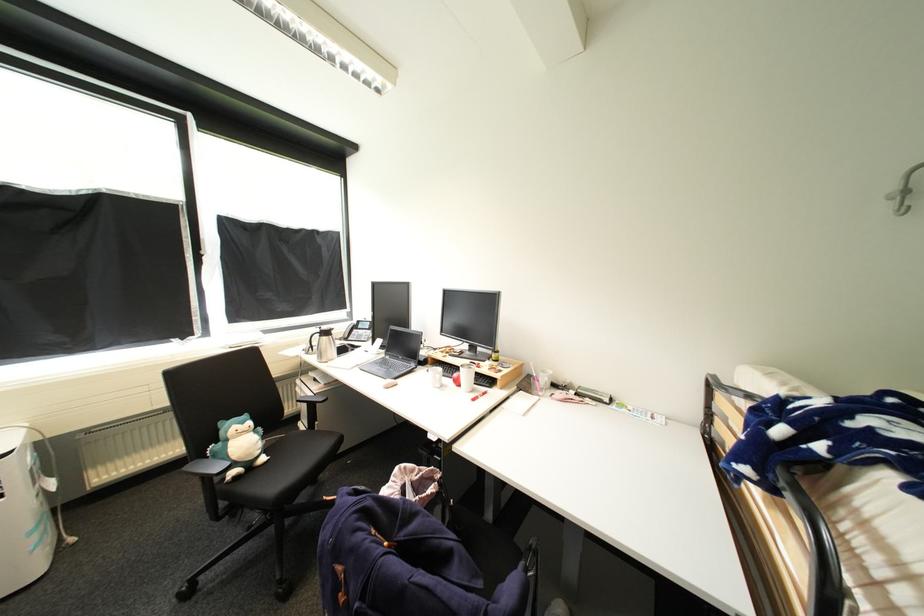
The width and height of the screenshot is (924, 616). What are the coordinates of `clear plastic cup` in the screenshot? It's located at (542, 381).